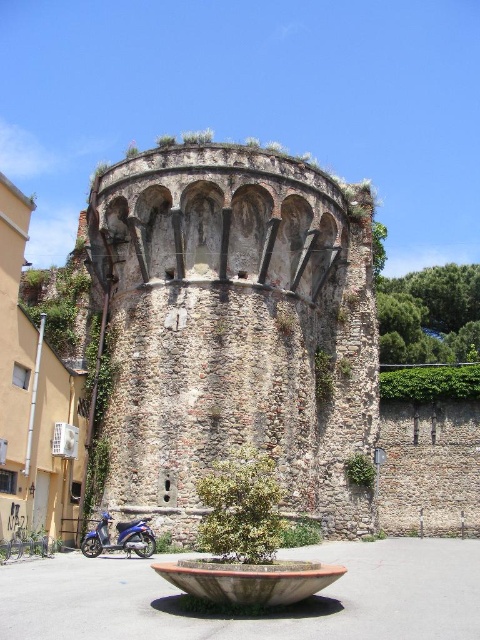
Is point (144, 157) positioned behind point (134, 536)?

That is True.

Locate an element on the screen. The height and width of the screenshot is (640, 480). stone textured tower at center is located at coordinates (235, 326).

I want to click on stone textured tower at center, so click(x=235, y=326).